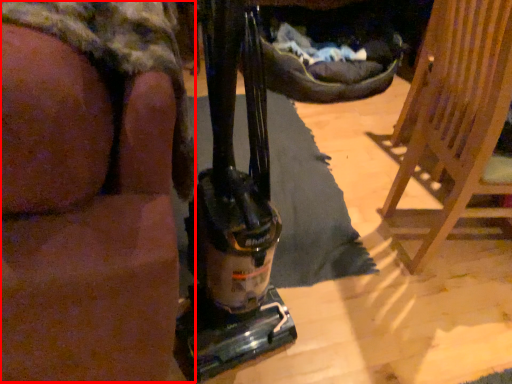
Question: In this image, where is person (annotated by the red box) located relative to furniture?

Choices:
 (A) right
 (B) left

Answer: (B)